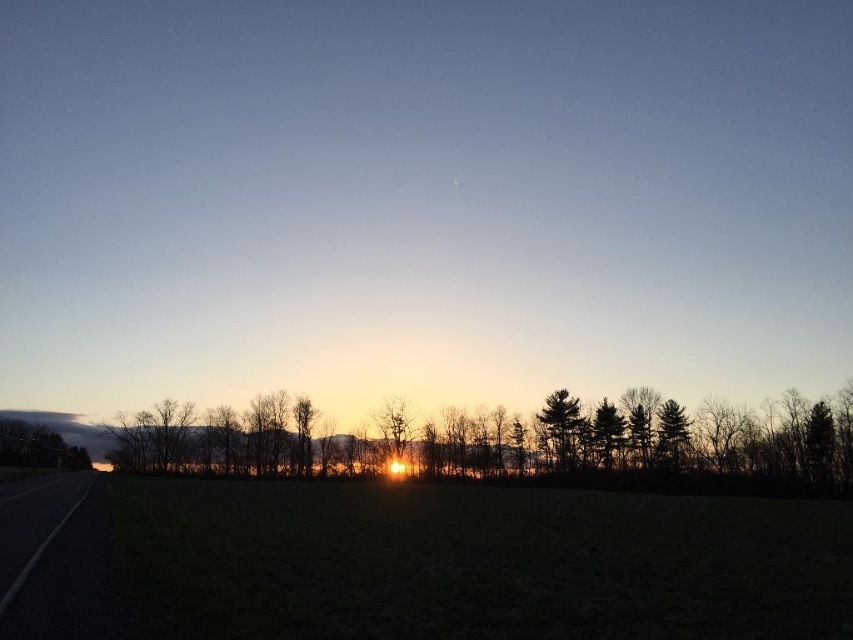
Can you confirm if silhouette trees at center is wider than black asphalt highway at lower left?

Indeed, silhouette trees at center has a greater width compared to black asphalt highway at lower left.

Is the position of silhouette trees at center less distant than that of black asphalt highway at lower left?

No, silhouette trees at center is behind black asphalt highway at lower left.

Locate an element on the screen. This screenshot has height=640, width=853. silhouette trees at center is located at coordinates (515, 444).

The image size is (853, 640). In order to click on silhouette trees at center in this screenshot , I will do point(515,444).

Can you confirm if silhouette trees at center is positioned below dark green textured tree at center right?

Indeed, silhouette trees at center is positioned under dark green textured tree at center right.

Based on the photo, measure the distance between silhouette trees at center and camera.

1338.01 feet

Between point (666, 445) and point (561, 429), which one is positioned behind?

The point (561, 429) is more distant.

This screenshot has width=853, height=640. What are the coordinates of `silhouette trees at center` in the screenshot? It's located at (x=515, y=444).

Does black asphalt highway at lower left appear over dark green textured tree at center right?

Yes, black asphalt highway at lower left is above dark green textured tree at center right.

Can you confirm if black asphalt highway at lower left is positioned to the left of dark green textured tree at center right?

Correct, you'll find black asphalt highway at lower left to the left of dark green textured tree at center right.

Is point (109, 636) farther from viewer compared to point (560, 396)?

No, (109, 636) is in front of (560, 396).

Locate an element on the screen. The width and height of the screenshot is (853, 640). black asphalt highway at lower left is located at coordinates (56, 561).